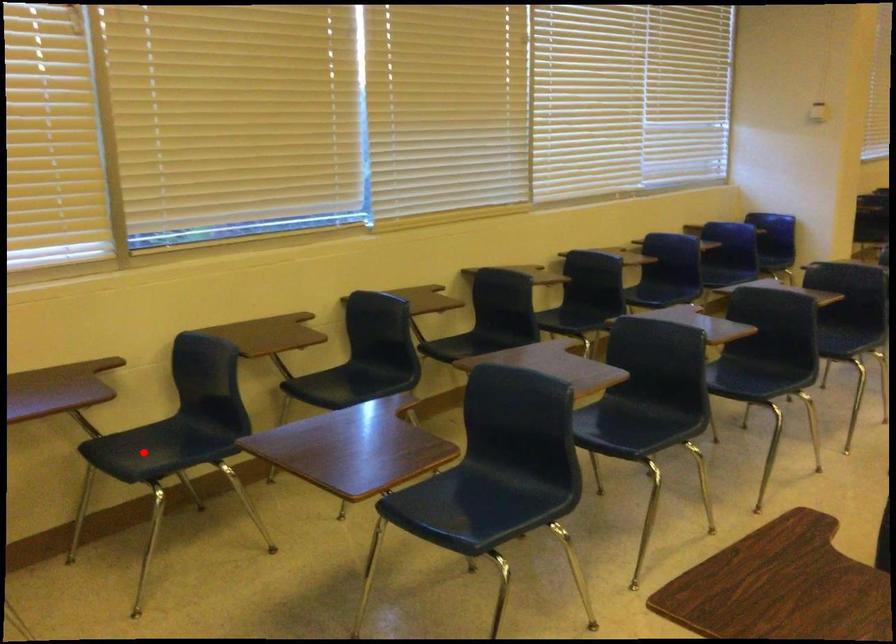
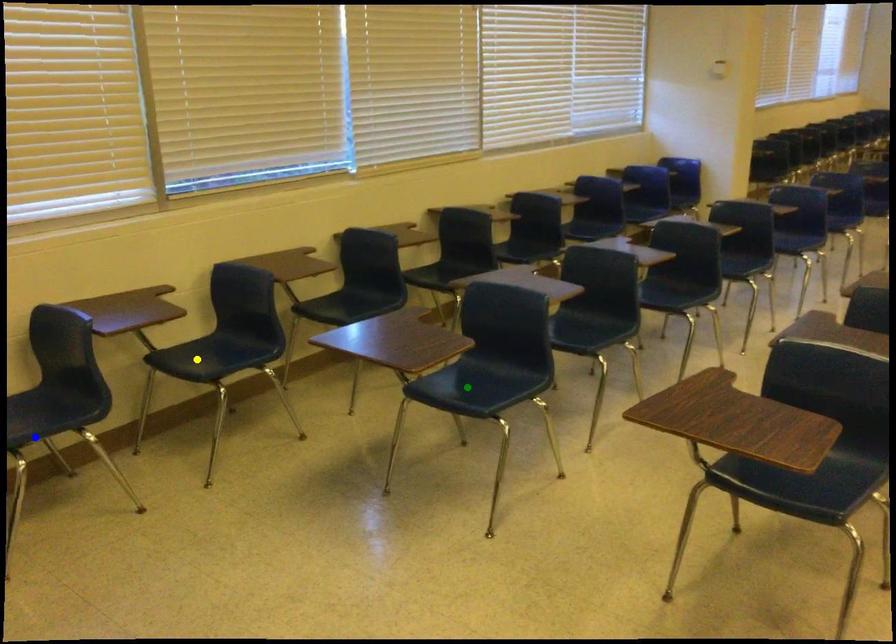
Question: I am providing you with two images of the same scene from different viewpoints. A red point is marked on the first image. You are given multiple points on the second image. Can you choose the point in image 2 that corresponds to the point in image 1?

Choices:
 (A) blue point
 (B) yellow point
 (C) green point

Answer: (B)